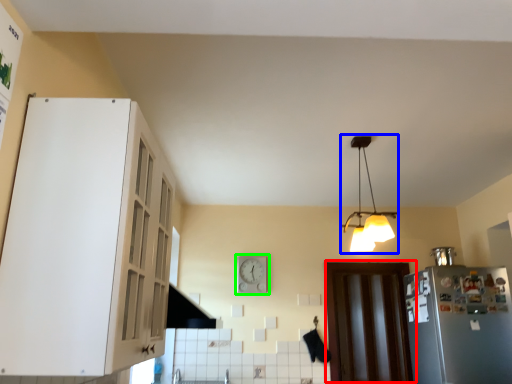
Question: Considering the real-world distances, which object is farthest from door (highlighted by a red box)? lamp (highlighted by a blue box) or clock (highlighted by a green box)?

Choices:
 (A) lamp
 (B) clock

Answer: (A)